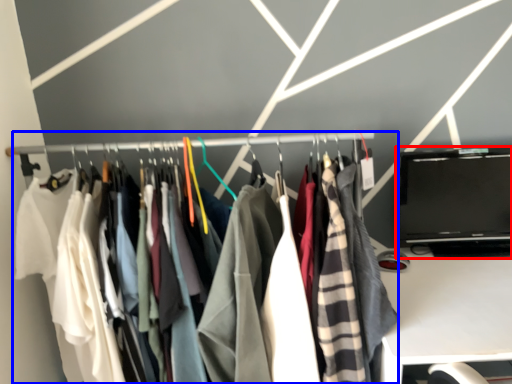
Question: Among these objects, which one is farthest to the camera, laptop (highlighted by a red box) or closet (highlighted by a blue box)?

Choices:
 (A) laptop
 (B) closet

Answer: (A)